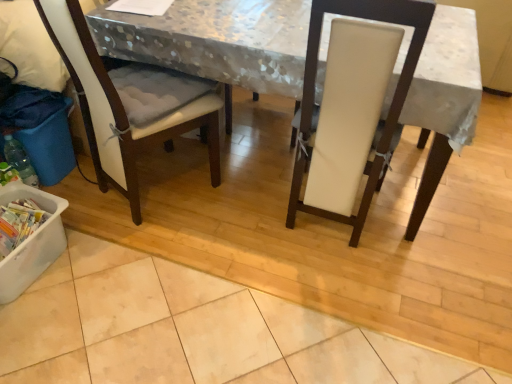
Locate an element on the screen. The height and width of the screenshot is (384, 512). unoccupied region to the right of white leather chair at center, which is the 1th chair from right to left is located at coordinates 419,227.